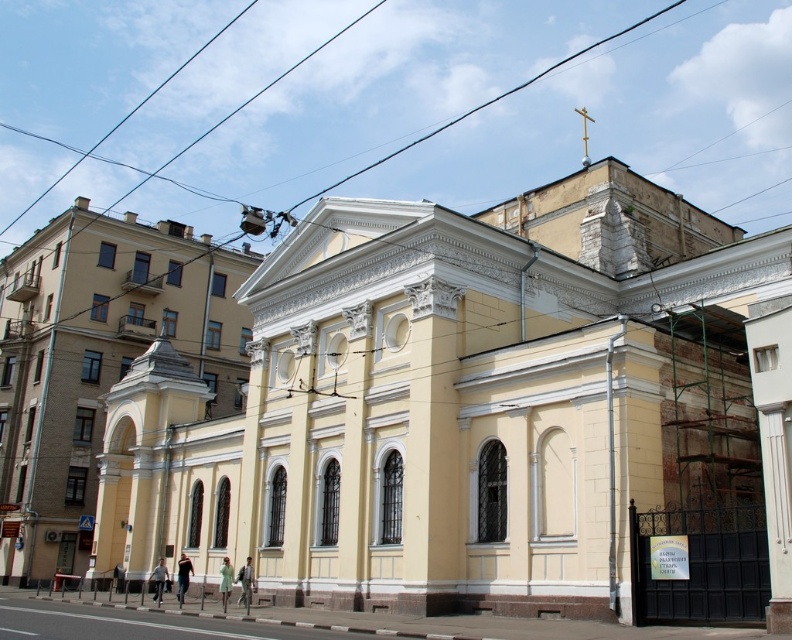
Where is `yellow matte church at center`? yellow matte church at center is located at coordinates (484, 416).

Consider the image. Is yellow matte church at center behind yellow smooth church at center?

That is False.

Does point (585, 444) come behind point (179, 296)?

No, it is in front of (179, 296).

Find the location of a particular element. Image resolution: width=792 pixels, height=640 pixels. yellow matte church at center is located at coordinates (484, 416).